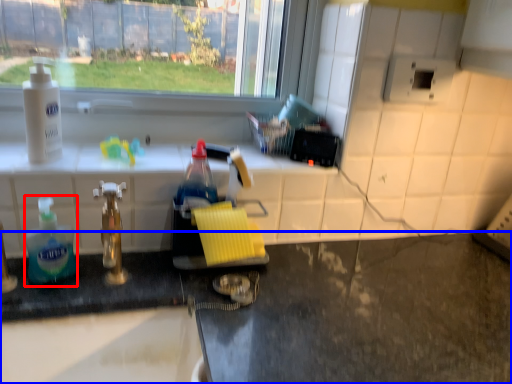
Question: Which object appears closest to the camera in this image, bottle (highlighted by a red box) or counter (highlighted by a blue box)?

Choices:
 (A) bottle
 (B) counter

Answer: (B)